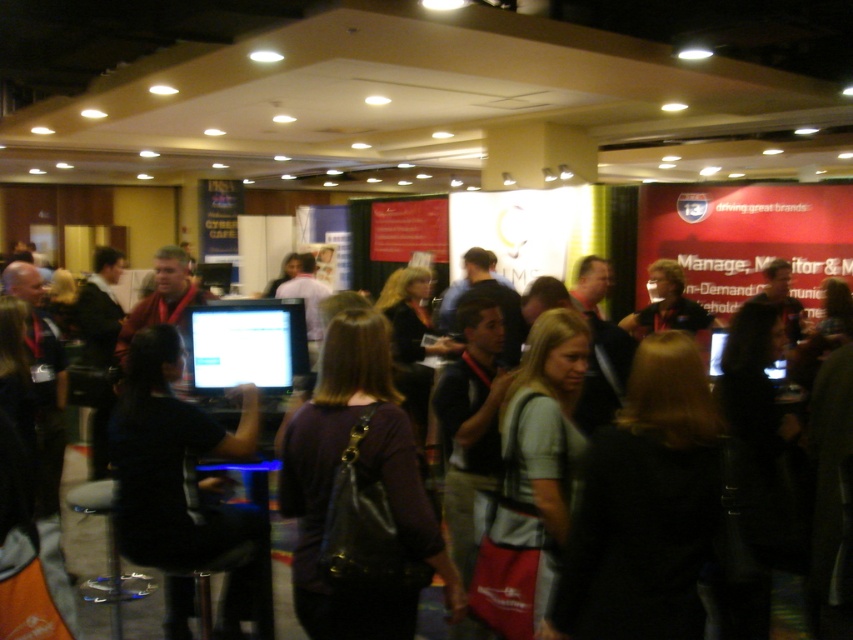
Is dark purple fabric shirt at center smaller than matte plastic monitor at center?

No.

Which is behind, point (399, 572) or point (196, 337)?

The point (196, 337) is behind.

Locate an element on the screen. This screenshot has height=640, width=853. dark purple fabric shirt at center is located at coordinates (358, 483).

Based on the photo, measure the distance from black matte computer at center to matte plastic monitor at center.

A distance of 16.33 inches exists between black matte computer at center and matte plastic monitor at center.

Who is more forward, (155, 324) or (265, 330)?

Point (265, 330) is more forward.

Which is in front, point (154, 384) or point (248, 353)?

Positioned in front is point (154, 384).

Where is `black matte computer at center`? Image resolution: width=853 pixels, height=640 pixels. black matte computer at center is located at coordinates (172, 460).

Which is more to the left, dark purple fabric shirt at center or black matte computer at center?

black matte computer at center

Is dark purple fabric shirt at center thinner than black matte computer at center?

No, dark purple fabric shirt at center is not thinner than black matte computer at center.

Locate an element on the screen. This screenshot has height=640, width=853. dark purple fabric shirt at center is located at coordinates (358, 483).